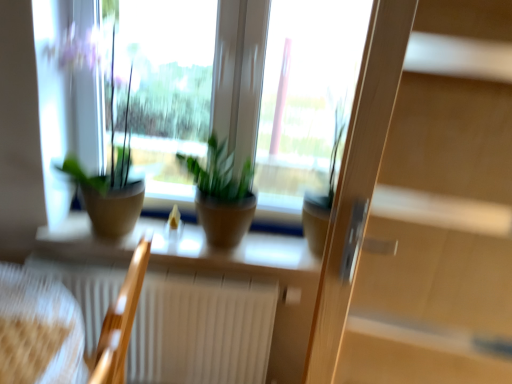
Question: Does green matte plant at center, which ranks as the third houseplant in left-to-right order, have a lesser width compared to wooden armchair at lower left, the 2th armchair positioned from the right?

Choices:
 (A) no
 (B) yes

Answer: (B)

Question: From the image's perspective, would you say green matte plant at center, which ranks as the third houseplant in left-to-right order, is shown under wooden armchair at lower left, the first armchair viewed from the left?

Choices:
 (A) no
 (B) yes

Answer: (A)

Question: Are green matte plant at center, the first houseplant from the right, and wooden armchair at lower left, the 2th armchair positioned from the right, beside each other?

Choices:
 (A) no
 (B) yes

Answer: (A)

Question: Considering the relative positions of green matte plant at center, the first houseplant from the right, and wooden armchair at lower left, the 2th armchair positioned from the right, in the image provided, is green matte plant at center, the first houseplant from the right, in front of wooden armchair at lower left, the 2th armchair positioned from the right,?

Choices:
 (A) no
 (B) yes

Answer: (A)

Question: From a real-world perspective, is green matte plant at center, which ranks as the third houseplant in left-to-right order, beneath wooden armchair at lower left, the 2th armchair positioned from the right?

Choices:
 (A) no
 (B) yes

Answer: (A)

Question: Is green matte plant at center, which ranks as the third houseplant in left-to-right order, wider or thinner than wooden armchair at lower left, the 2th armchair in the left-to-right sequence?

Choices:
 (A) wide
 (B) thin

Answer: (A)

Question: In terms of height, does green matte plant at center, which ranks as the third houseplant in left-to-right order, look taller or shorter compared to wooden armchair at lower left, the first armchair from the right?

Choices:
 (A) short
 (B) tall

Answer: (A)

Question: Considering the relative positions of green matte plant at center, the first houseplant from the right, and wooden armchair at lower left, the 2th armchair in the left-to-right sequence, in the image provided, is green matte plant at center, the first houseplant from the right, to the left or to the right of wooden armchair at lower left, the 2th armchair in the left-to-right sequence,?

Choices:
 (A) left
 (B) right

Answer: (B)

Question: From a real-world perspective, is green matte plant at center, the first houseplant from the right, physically located above or below wooden armchair at lower left, the 2th armchair in the left-to-right sequence?

Choices:
 (A) below
 (B) above

Answer: (B)

Question: Considering the positions of point (81, 82) and point (228, 196), is point (81, 82) closer or farther from the camera than point (228, 196)?

Choices:
 (A) farther
 (B) closer

Answer: (A)

Question: From a real-world perspective, relative to green matte plant at center, the 2th houseplant when ordered from left to right, is green matte plant pot at left, the 1th houseplant when ordered from left to right, vertically above or below?

Choices:
 (A) above
 (B) below

Answer: (A)

Question: Considering the positions of green matte plant pot at left, the third houseplant when ordered from right to left, and green matte plant at center, marked as the second houseplant in a right-to-left arrangement, in the image, is green matte plant pot at left, the third houseplant when ordered from right to left, bigger or smaller than green matte plant at center, marked as the second houseplant in a right-to-left arrangement,?

Choices:
 (A) small
 (B) big

Answer: (B)

Question: Is green matte plant pot at left, the 1th houseplant when ordered from left to right, in front of or behind green matte plant at center, marked as the second houseplant in a right-to-left arrangement, in the image?

Choices:
 (A) behind
 (B) front

Answer: (B)

Question: From a real-world perspective, is green matte plant at center, the 2th houseplant when ordered from left to right, physically located above or below matte brown pot at center?

Choices:
 (A) below
 (B) above

Answer: (B)

Question: In terms of height, does green matte plant at center, the 2th houseplant when ordered from left to right, look taller or shorter compared to matte brown pot at center?

Choices:
 (A) tall
 (B) short

Answer: (A)